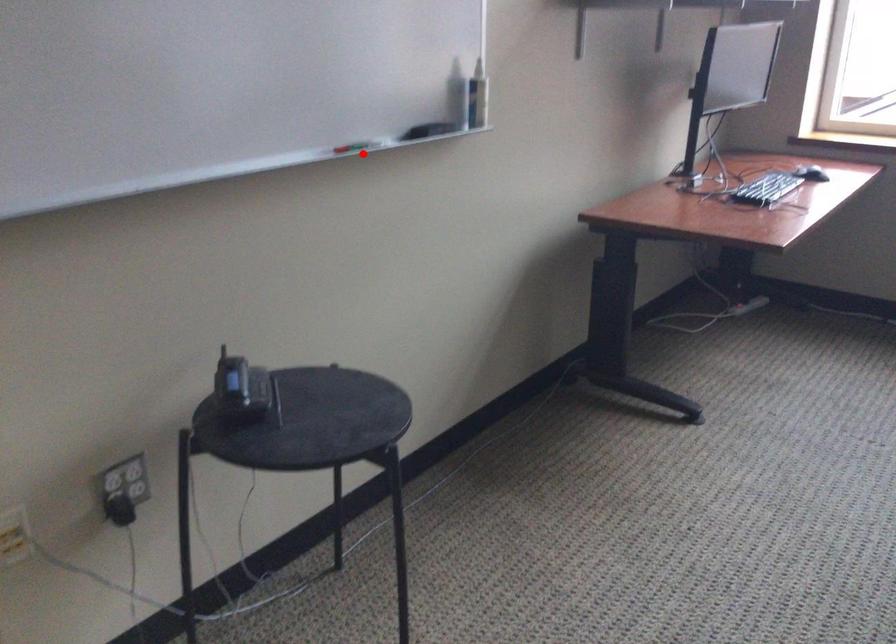
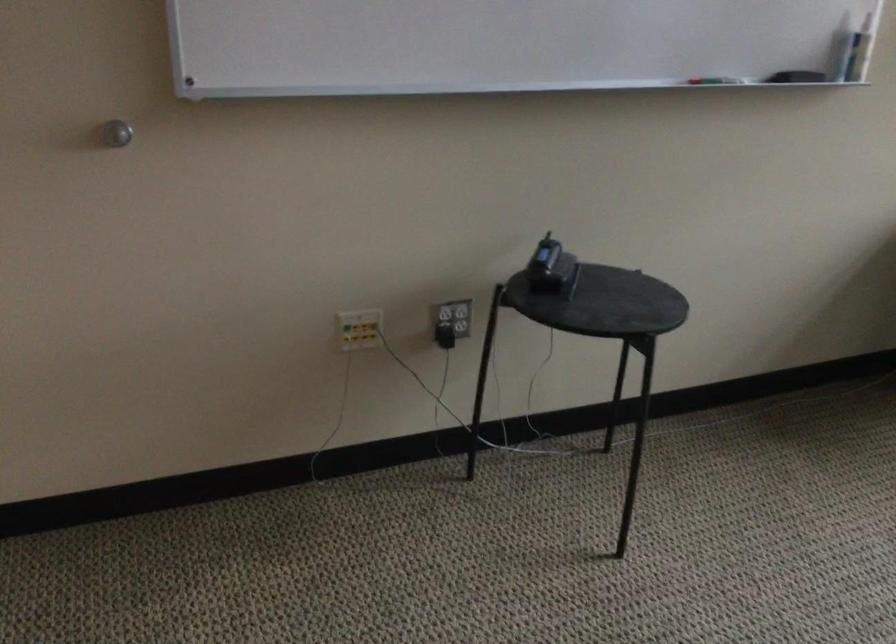
Where in the second image is the point corresponding to the highlighted location from the first image?

(714, 80)